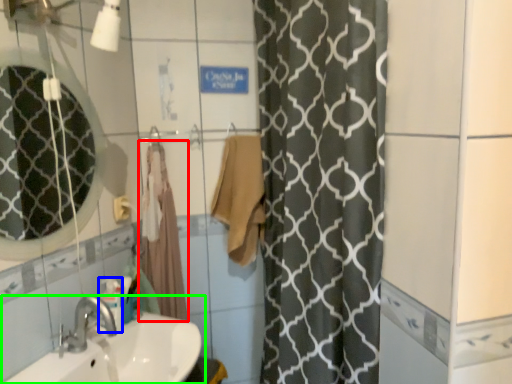
Question: Which object is the closest to the bath towel (highlighted by a red box)? Choose among these: toiletry (highlighted by a blue box) or sink (highlighted by a green box).

Choices:
 (A) toiletry
 (B) sink

Answer: (A)